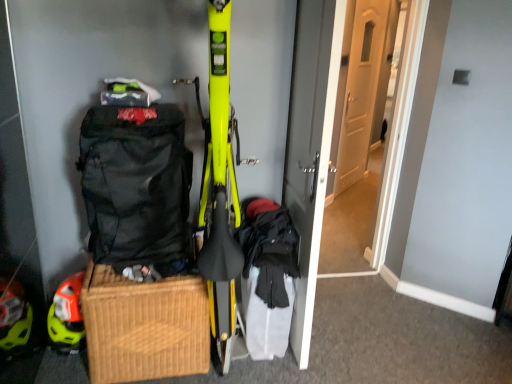
Image resolution: width=512 pixels, height=384 pixels. What are the coordinates of `free space in front of orange matte helmet at lower left` in the screenshot? It's located at (65, 374).